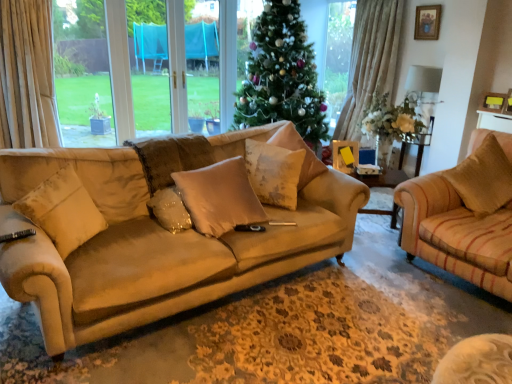
Find the location of a particular element. This screenshot has width=512, height=384. vacant location below wooden side table at center (from a real-world perspective) is located at coordinates (372, 239).